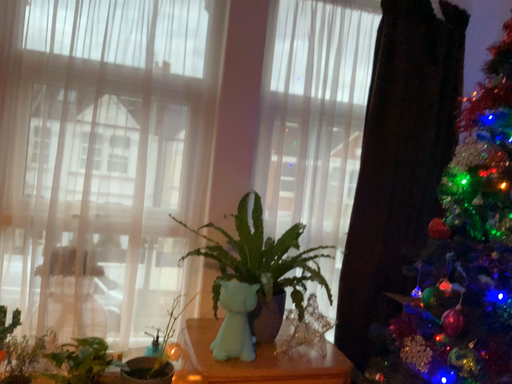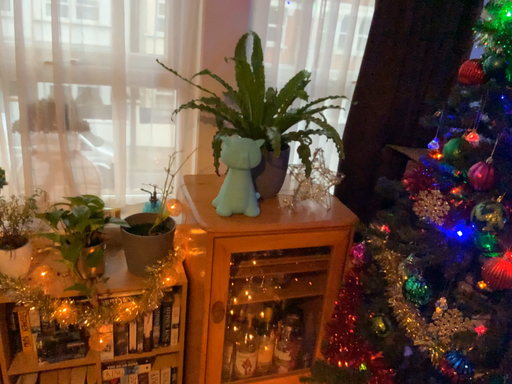
Question: Which way did the camera rotate in the video?

Choices:
 (A) rotated downward
 (B) rotated upward

Answer: (A)